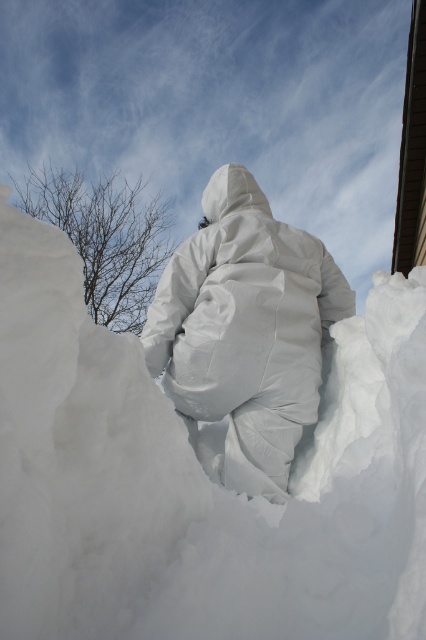
You are an artist planning to create a new sculpture next to the existing ones. You have two materials available, the white fluffy snow at center and the white matte snowsuit at center. Which material do you think you should use if you want your sculpture to be larger than the existing ones?

The white fluffy snow at center is smaller than the white matte snowsuit at center. To create a larger sculpture, you should use the white matte snowsuit at center since it is already larger than the white fluffy snow at center.

You are an artist trying to create a snow sculpture. You have a white fluffy snow at center and a white matte snowsuit at center. Which object is located lower in the scene?

The white fluffy snow at center is located below the white matte snowsuit at center, so the white fluffy snow at center is lower in the scene.

You are an artist trying to create a snow sculpture. You have a white fluffy snow at center and a white matte snowsuit at center in front of you. Which object is wider?

The white fluffy snow at center is wider than the white matte snowsuit at center.